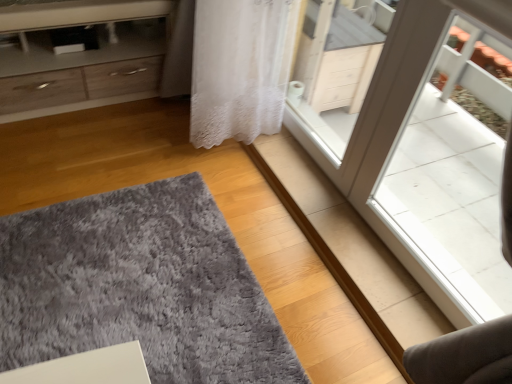
Question: In terms of size, does matte wood chest of drawers at upper left appear bigger or smaller than gray shaggy rug at lower left?

Choices:
 (A) big
 (B) small

Answer: (A)

Question: Is matte wood chest of drawers at upper left inside or outside of gray shaggy rug at lower left?

Choices:
 (A) outside
 (B) inside

Answer: (A)

Question: Relative to gray shaggy rug at lower left, is matte wood chest of drawers at upper left in front or behind?

Choices:
 (A) behind
 (B) front

Answer: (A)

Question: Looking at the image, does gray shaggy rug at lower left seem bigger or smaller compared to matte wood chest of drawers at upper left?

Choices:
 (A) small
 (B) big

Answer: (A)

Question: From a real-world perspective, is gray shaggy rug at lower left positioned above or below matte wood chest of drawers at upper left?

Choices:
 (A) below
 (B) above

Answer: (A)

Question: Considering the positions of gray shaggy rug at lower left and matte wood chest of drawers at upper left in the image, is gray shaggy rug at lower left wider or thinner than matte wood chest of drawers at upper left?

Choices:
 (A) thin
 (B) wide

Answer: (B)

Question: From the image's perspective, relative to matte wood chest of drawers at upper left, is gray shaggy rug at lower left above or below?

Choices:
 (A) above
 (B) below

Answer: (B)